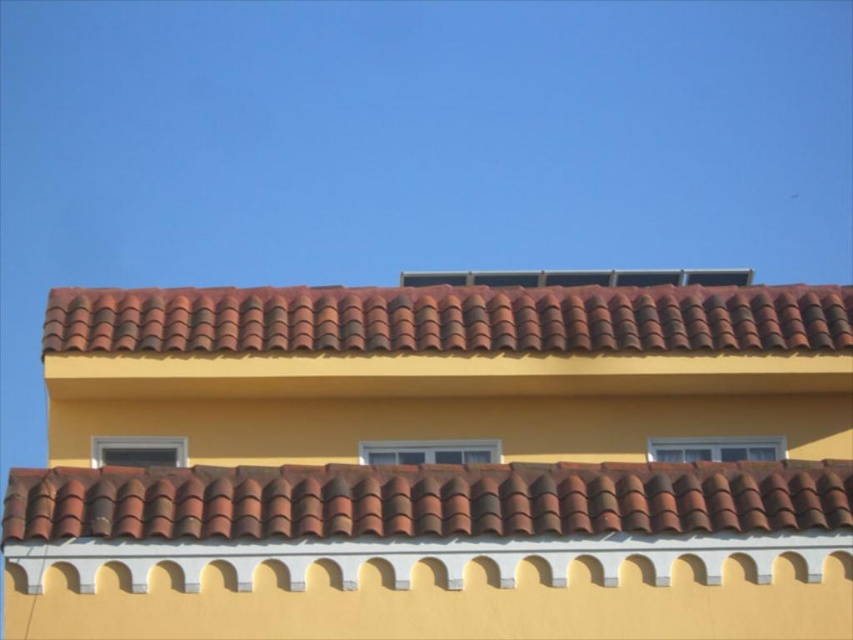
Question: Which point is closer to the camera?

Choices:
 (A) brown clay tiles at top
 (B) brown clay tiles at center

Answer: (B)

Question: Can you confirm if brown clay tiles at center is positioned to the right of brown clay tiles at top?

Choices:
 (A) no
 (B) yes

Answer: (B)

Question: Is brown clay tiles at center bigger than brown clay tiles at top?

Choices:
 (A) yes
 (B) no

Answer: (B)

Question: Can you confirm if brown clay tiles at center is wider than brown clay tiles at top?

Choices:
 (A) no
 (B) yes

Answer: (A)

Question: Which object is closer to the camera taking this photo?

Choices:
 (A) brown clay tiles at center
 (B) brown clay tiles at top

Answer: (A)

Question: Which point appears closest to the camera in this image?

Choices:
 (A) (288, 317)
 (B) (323, 493)

Answer: (B)